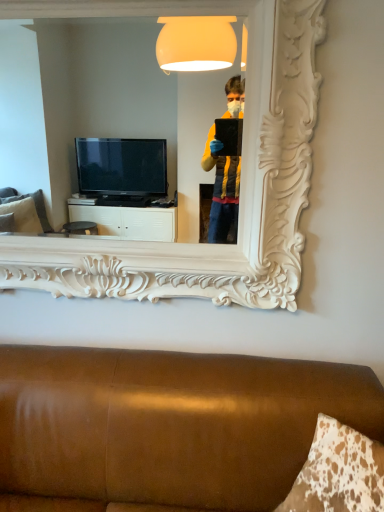
Question: Is the position of white carved mirror at upper center less distant than that of brown leather couch at lower center?

Choices:
 (A) no
 (B) yes

Answer: (A)

Question: Is white carved mirror at upper center located outside brown leather couch at lower center?

Choices:
 (A) yes
 (B) no

Answer: (A)

Question: From a real-world perspective, does white carved mirror at upper center stand above brown leather couch at lower center?

Choices:
 (A) no
 (B) yes

Answer: (B)

Question: Is brown leather couch at lower center completely or partially inside white carved mirror at upper center?

Choices:
 (A) yes
 (B) no

Answer: (B)

Question: From the image's perspective, is white carved mirror at upper center under brown leather couch at lower center?

Choices:
 (A) no
 (B) yes

Answer: (A)

Question: Does white carved mirror at upper center have a lesser width compared to brown leather couch at lower center?

Choices:
 (A) no
 (B) yes

Answer: (B)

Question: Is brown leather couch at lower center positioned behind white carved mirror at upper center?

Choices:
 (A) yes
 (B) no

Answer: (B)

Question: Can white carved mirror at upper center be found inside brown leather couch at lower center?

Choices:
 (A) yes
 (B) no

Answer: (B)

Question: Is brown leather couch at lower center shorter than white carved mirror at upper center?

Choices:
 (A) no
 (B) yes

Answer: (B)

Question: From the image's perspective, is brown leather couch at lower center located above white carved mirror at upper center?

Choices:
 (A) no
 (B) yes

Answer: (A)

Question: Can you confirm if brown leather couch at lower center is wider than white carved mirror at upper center?

Choices:
 (A) no
 (B) yes

Answer: (B)

Question: Can you confirm if brown leather couch at lower center is thinner than white carved mirror at upper center?

Choices:
 (A) yes
 (B) no

Answer: (B)

Question: Is white carved mirror at upper center wider or thinner than brown leather couch at lower center?

Choices:
 (A) thin
 (B) wide

Answer: (A)